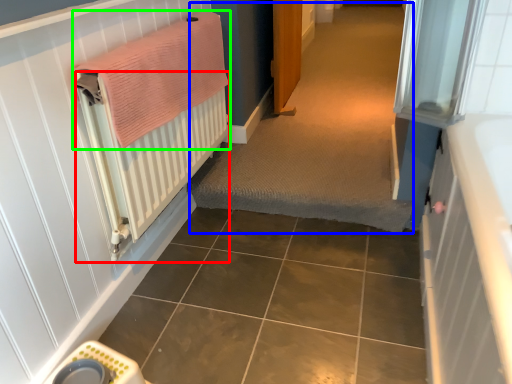
Question: Based on their relative distances, which object is nearer to radiator (highlighted by a red box)? Choose from plain (highlighted by a blue box) and bath towel (highlighted by a green box).

Choices:
 (A) plain
 (B) bath towel

Answer: (B)